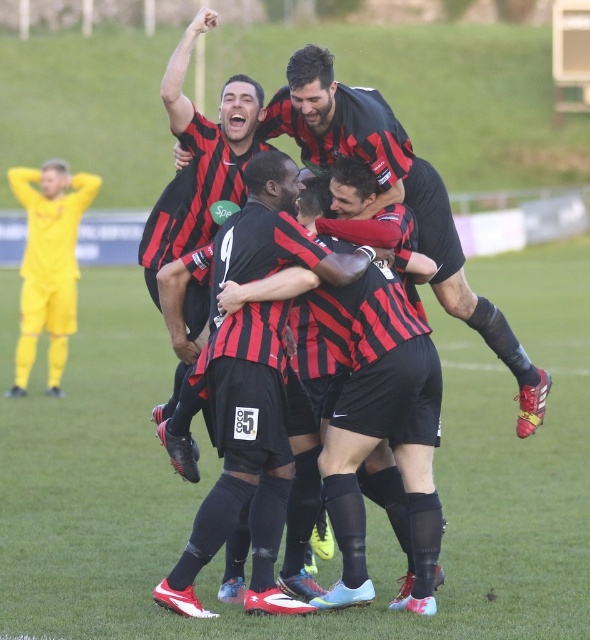
Question: Which of the following is the closest to the observer?

Choices:
 (A) (22, 294)
 (B) (476, 426)
 (C) (352, 589)
 (D) (408, 198)

Answer: (C)

Question: Can you confirm if matte black shorts at center is positioned to the right of yellow jersey at left?

Choices:
 (A) no
 (B) yes

Answer: (B)

Question: Which of the following is the closest to the observer?

Choices:
 (A) green grass at center
 (B) matte black shorts at center
 (C) matte black soccer players at center

Answer: (A)

Question: Does matte black shorts at center have a smaller size compared to matte black soccer players at center?

Choices:
 (A) no
 (B) yes

Answer: (A)

Question: Estimate the real-world distances between objects in this image. Which object is farther from the yellow jersey at left?

Choices:
 (A) matte black shorts at center
 (B) matte black soccer players at center
 (C) green grass at center

Answer: (B)

Question: Where is matte black shorts at center located in relation to yellow jersey at left in the image?

Choices:
 (A) below
 (B) above

Answer: (A)